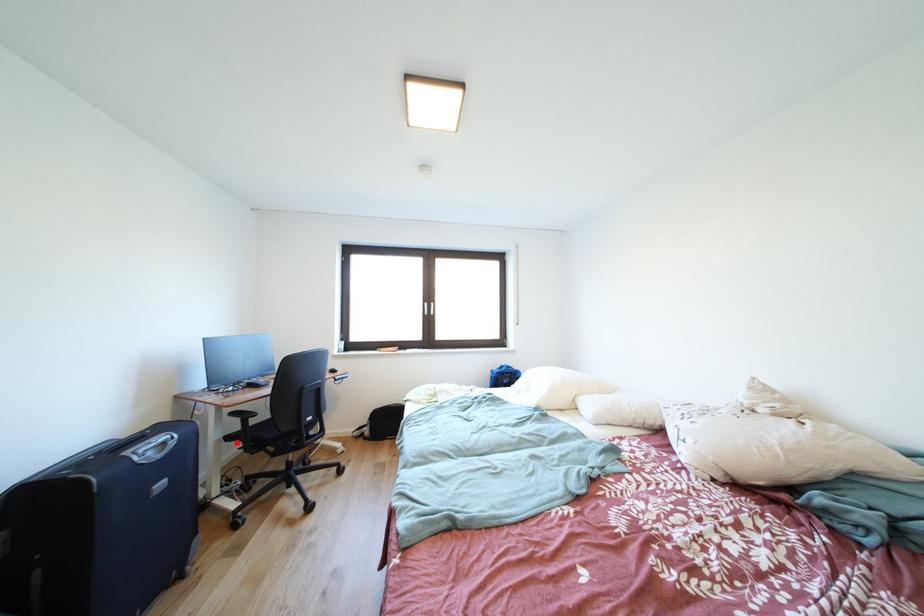
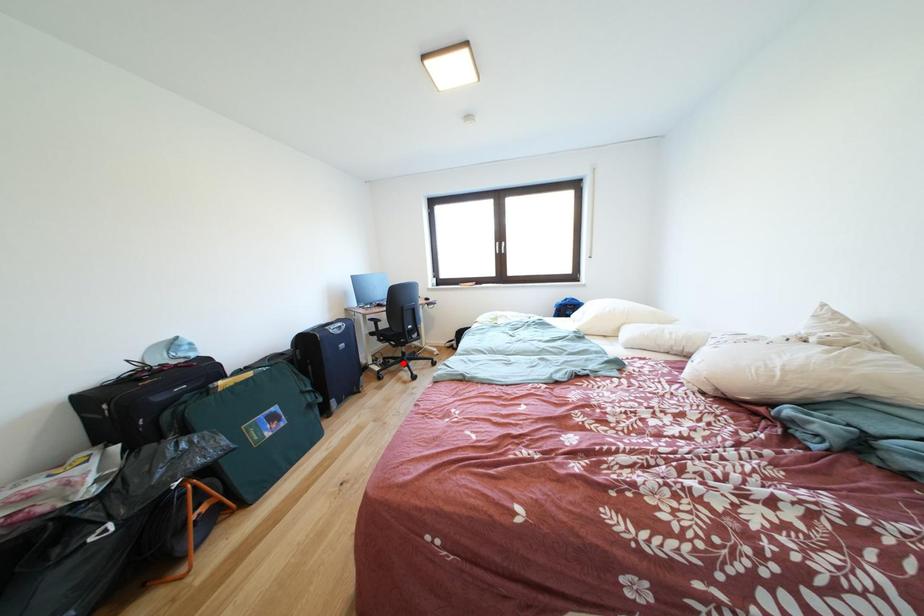
I am providing you with two images of the same scene from different viewpoints. A red point is marked on the first image and another point is marked on the second image. Is the marked point in image1 the same physical position as the marked point in image2?

No